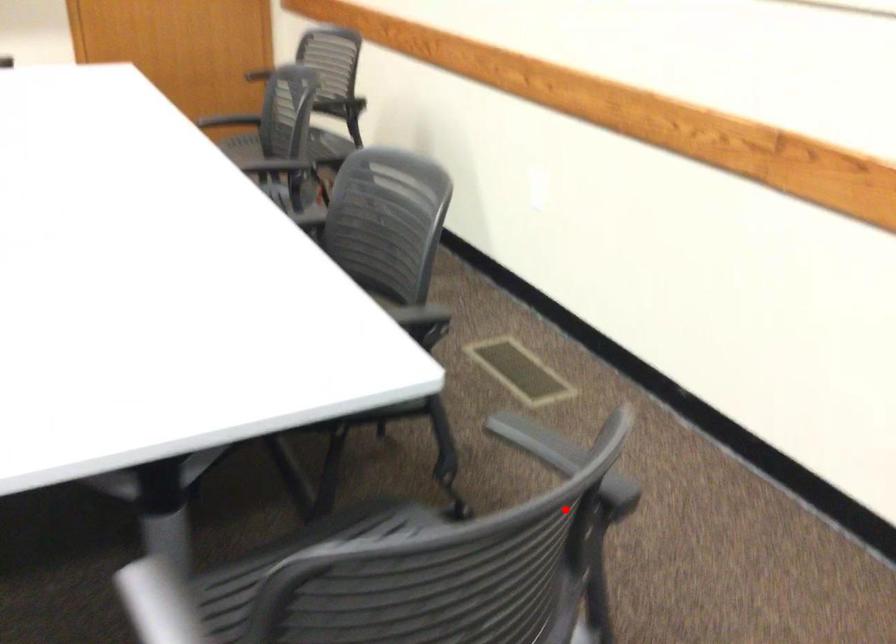
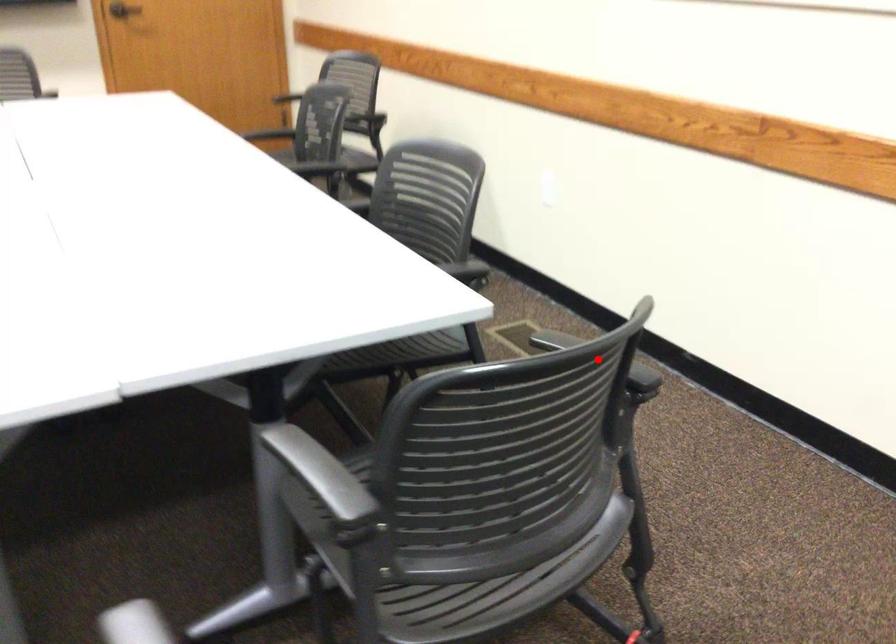
I am providing you with two images of the same scene from different viewpoints. A red point is marked on the first image and another point is marked on the second image. Does the point marked in image1 correspond to the same location as the one in image2?

Yes